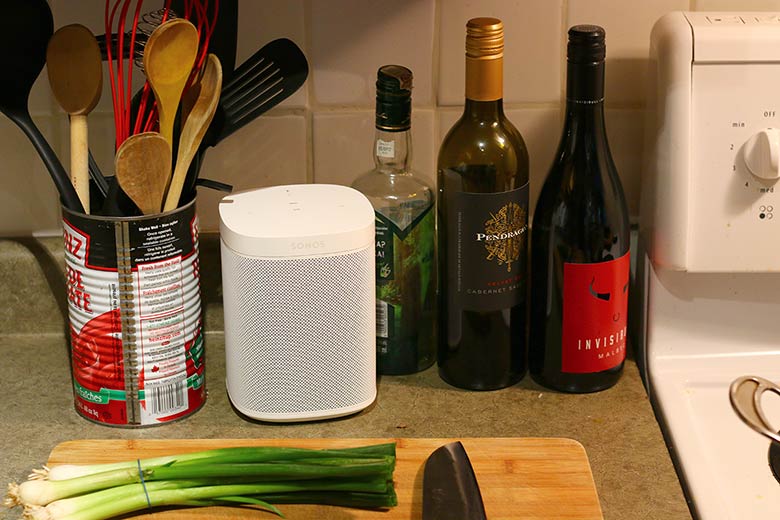
This screenshot has height=520, width=780. I want to click on white stove, so click(732, 462).